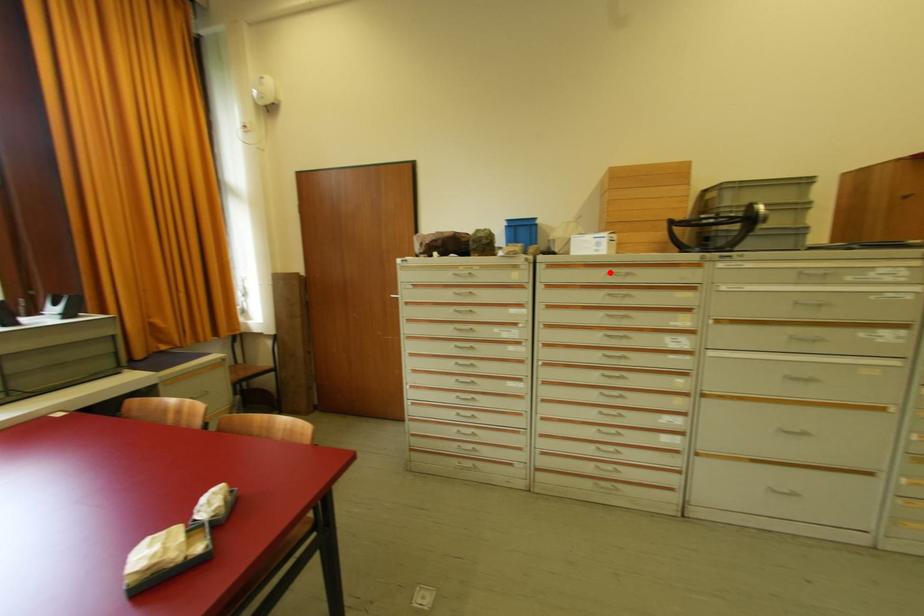
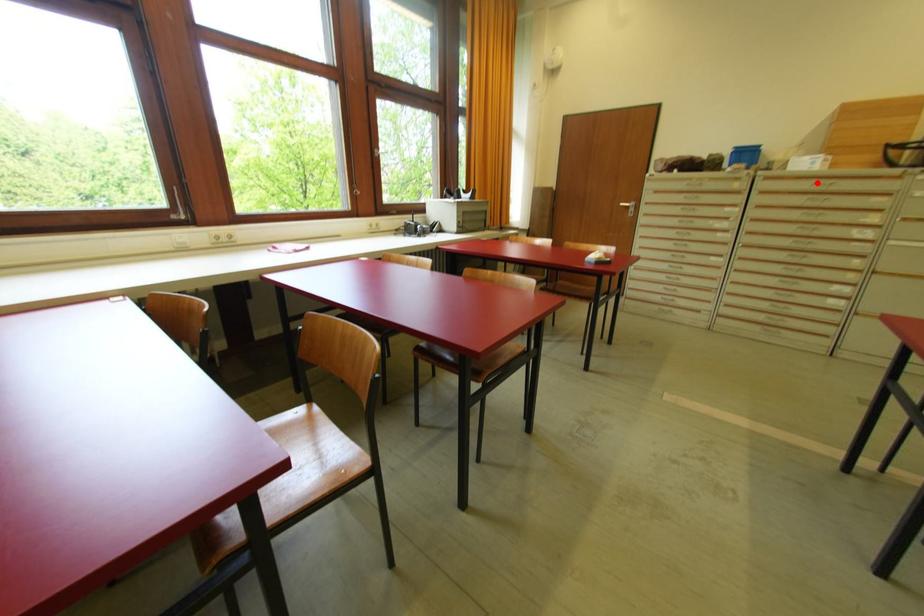
I am providing you with two images of the same scene from different viewpoints. A red point is marked on the first image and another point is marked on the second image. Does the point marked in image1 correspond to the same location as the one in image2?

Yes